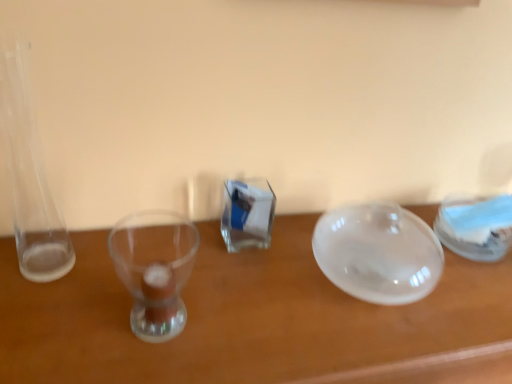
Find the location of a particular element. free space in front of transparent plastic container at right is located at coordinates (482, 281).